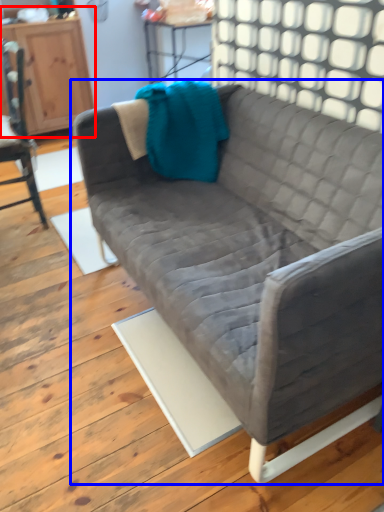
Question: Which point is closer to the camera, dresser (highlighted by a red box) or studio couch (highlighted by a blue box)?

Choices:
 (A) dresser
 (B) studio couch

Answer: (B)